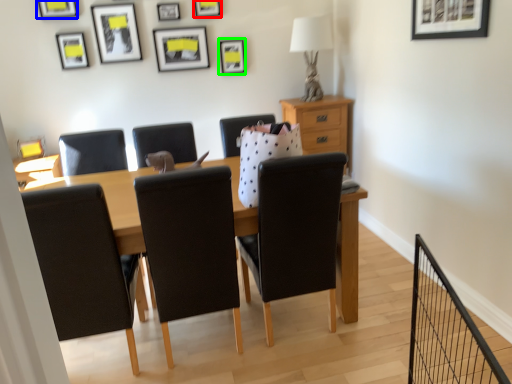
Question: Based on their relative distances, which object is nearer to picture frame (highlighted by a red box)? Choose from picture frame (highlighted by a blue box) and picture frame (highlighted by a green box).

Choices:
 (A) picture frame
 (B) picture frame

Answer: (B)